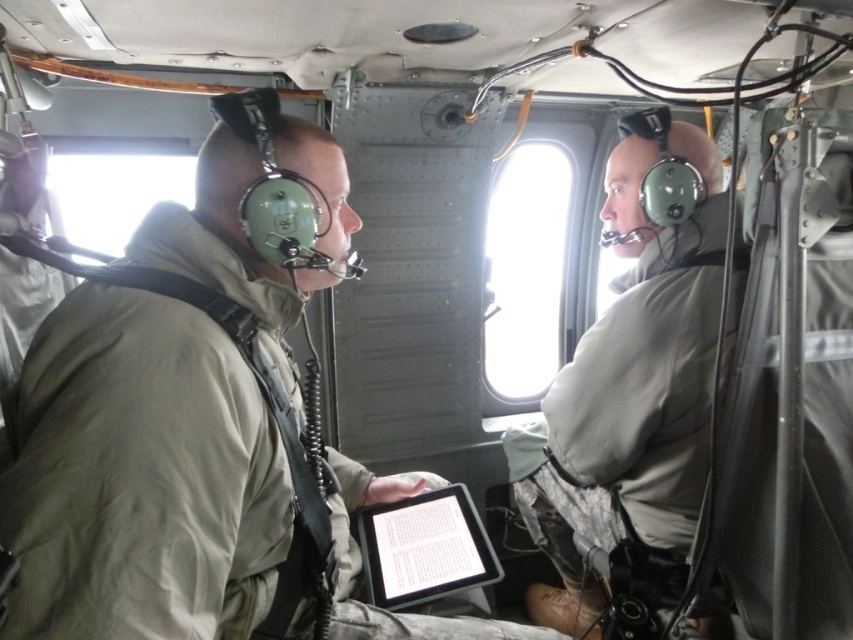
You are a technician inside the helicopter and need to locate both the matte green helmet at center and the black matte tablet at center. According to the scene, which object is positioned to the right of the other?

The matte green helmet at center is to the right of the black matte tablet at center.

You are a technician inspecting the helicopter cabin. You need to determine if the matte green helmet at center can be stored in a compartment designed for objects no taller than the black matte tablet at center. Based on their heights, what is your conclusion?

The matte green helmet at center is taller than the black matte tablet at center, so it cannot be stored in the compartment designed for objects no taller than the black matte tablet at center.